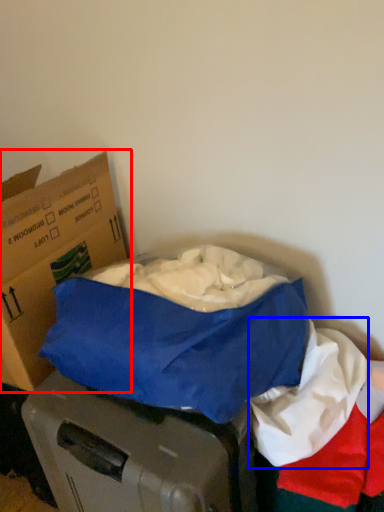
Question: Which of the following is the closest to the observer, box (highlighted by a red box) or linen (highlighted by a blue box)?

Choices:
 (A) box
 (B) linen

Answer: (B)